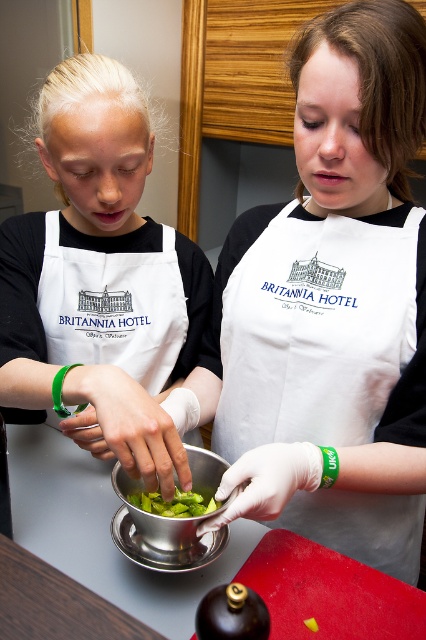
Describe the element at coordinates (319, 330) in the screenshot. The height and width of the screenshot is (640, 426). I see `white cotton apron at center` at that location.

Is point (264, 248) positioned behind point (175, 513)?

Yes, point (264, 248) is behind point (175, 513).

I want to click on white cotton apron at center, so click(x=319, y=330).

Does matte white apron at left have a lesser width compared to green leafy vegetable at center?

In fact, matte white apron at left might be wider than green leafy vegetable at center.

The image size is (426, 640). What do you see at coordinates (100, 280) in the screenshot? I see `matte white apron at left` at bounding box center [100, 280].

What are the coordinates of `matte white apron at left` in the screenshot? It's located at (100, 280).

The height and width of the screenshot is (640, 426). I want to click on matte white apron at left, so click(x=100, y=280).

Can you confirm if matte white apron at left is taller than metallic silver bowl at center?

Yes, matte white apron at left is taller than metallic silver bowl at center.

Which is in front, point (127, 214) or point (233, 493)?

Point (233, 493)

Locate an element on the screen. matte white apron at left is located at coordinates (100, 280).